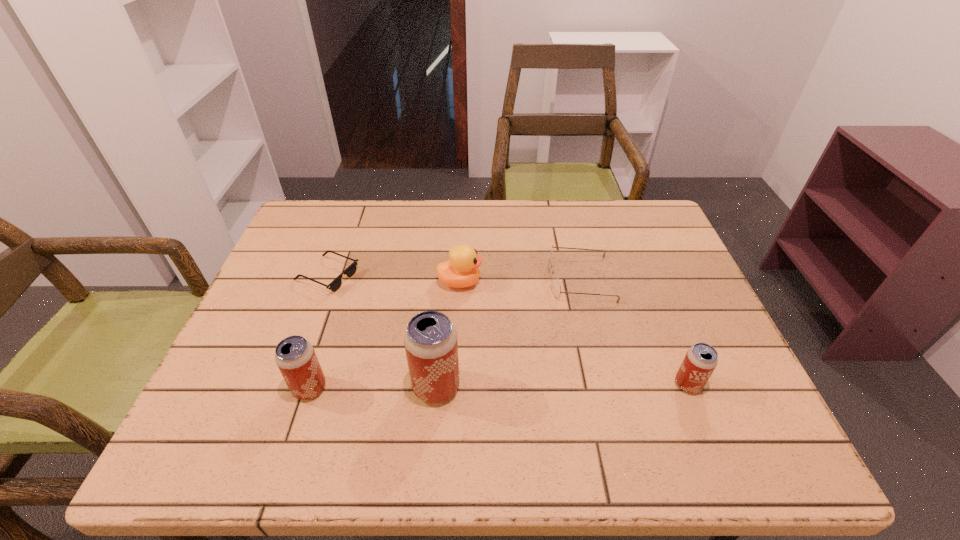
At what (x,y) coordinates should I click in order to perform the action: click on object at the near right corner. Please return your answer as a coordinate pair (x, y). Looking at the image, I should click on (701, 359).

In the image, there is a desktop. Identify the location of free region at the far edge. This screenshot has height=540, width=960. (489, 234).

You are a GUI agent. You are given a task and a screenshot of the screen. Output one action in this format:
    pyautogui.click(x=<x>, y=<y>)
    Task: Click on the free space at the near edge of the desktop
    Image resolution: width=960 pixels, height=540 pixels.
    Given the screenshot: What is the action you would take?
    pyautogui.click(x=372, y=389)

At what (x,y) coordinates should I click in order to perform the action: click on free space at the left edge of the desktop. Please return your answer as a coordinate pair (x, y). Looking at the image, I should click on (312, 252).

Identify the location of free space at the right edge of the desktop. (665, 249).

The height and width of the screenshot is (540, 960). Identify the location of free space at the far right corner of the desktop. (629, 222).

Identify the location of vacant area that lies between the second shortest object and the rightmost beer can. This screenshot has height=540, width=960. (634, 332).

The width and height of the screenshot is (960, 540). What are the coordinates of `free space between the fifth object from left to right and the duckling` in the screenshot? It's located at [520, 280].

You are a GUI agent. You are given a task and a screenshot of the screen. Output one action in this format:
    pyautogui.click(x=<x>, y=<y>)
    Task: Click on the vacant area that lies between the fifth tallest object and the shortest beer can
    This screenshot has height=540, width=960.
    Given the screenshot: What is the action you would take?
    pyautogui.click(x=634, y=332)

Locate an element on the screen. The width and height of the screenshot is (960, 540). vacant area that lies between the shortest object and the rightmost object is located at coordinates (508, 330).